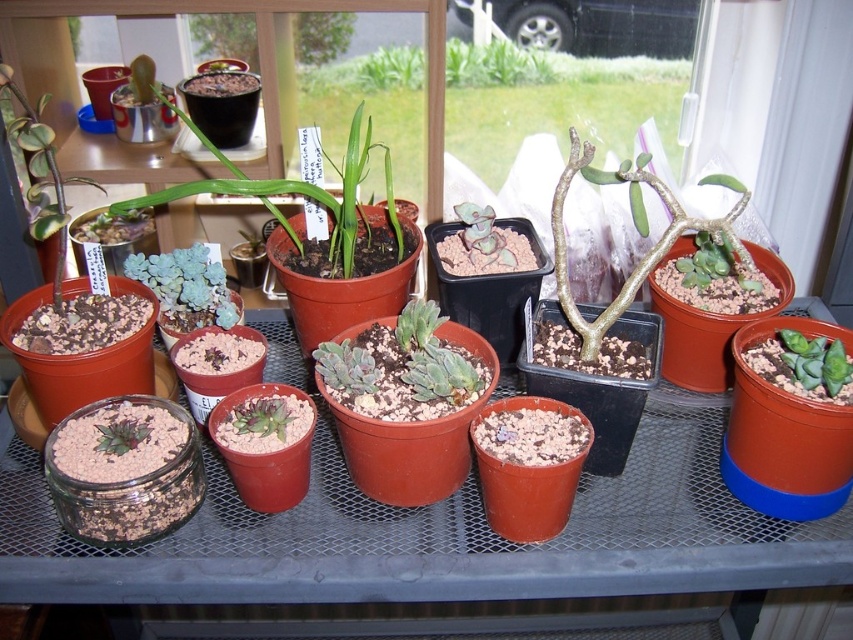
You are a gardener inspecting the metal shelf of potted plants. You notice two points marked on the shelf at coordinates point (286, 220) and point (166, 298). Which point is closer to you as you stand in front of the shelf?

Point (286, 220) is further to the viewer than point (166, 298), so the point closer to you is point (166, 298).

You are a gardener standing 1 meter away from a metal shelf with plants. You see the green matte succulent at center on the shelf. Can you reach it without moving closer?

The distance between you and the green matte succulent at center is 88.95 centimeters, which is less than 1 meter. Therefore, you can reach it without moving closer.